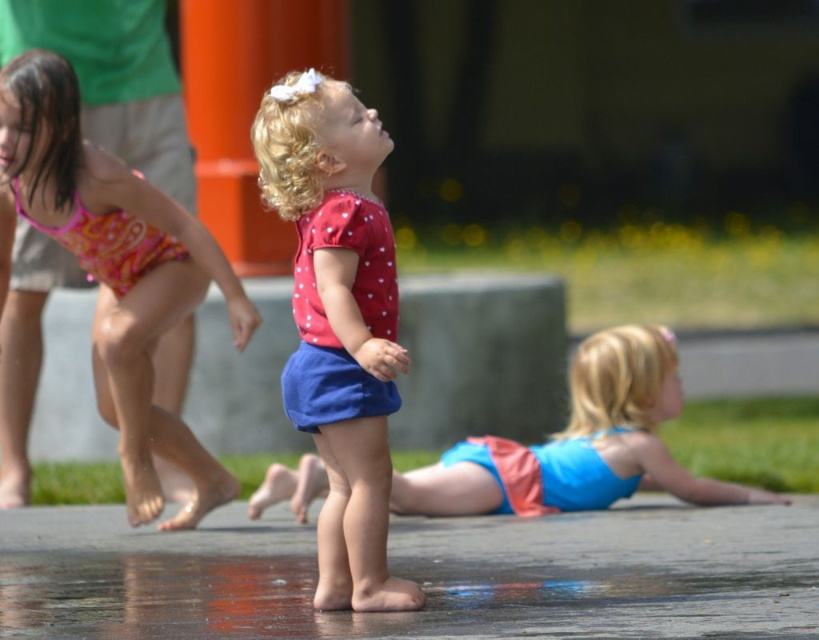
Measure the distance between matte red shirt at center and pink fabric swimsuit at left.

matte red shirt at center and pink fabric swimsuit at left are 2.13 meters apart.

Can you confirm if matte red shirt at center is taller than pink fabric swimsuit at left?

In fact, matte red shirt at center may be shorter than pink fabric swimsuit at left.

Measure the distance between matte red shirt at center and camera.

A distance of 22.75 feet exists between matte red shirt at center and camera.

Where is `matte red shirt at center`? matte red shirt at center is located at coordinates point(338,321).

Is point (320, 365) less distant than point (483, 504)?

That is True.

Is matte red shirt at center closer to camera compared to matte blue shorts at center?

Yes, it is.

Where is `matte red shirt at center`? This screenshot has width=819, height=640. matte red shirt at center is located at coordinates (338, 321).

Who is lower down, wet concrete pavement at center or matte blue shorts at center?

Positioned lower is wet concrete pavement at center.

Is wet concrete pavement at center below matte blue shorts at center?

Correct, wet concrete pavement at center is located below matte blue shorts at center.

Which is behind, point (645, 566) or point (630, 460)?

Positioned behind is point (630, 460).

Locate an element on the screen. This screenshot has height=640, width=819. wet concrete pavement at center is located at coordinates (419, 573).